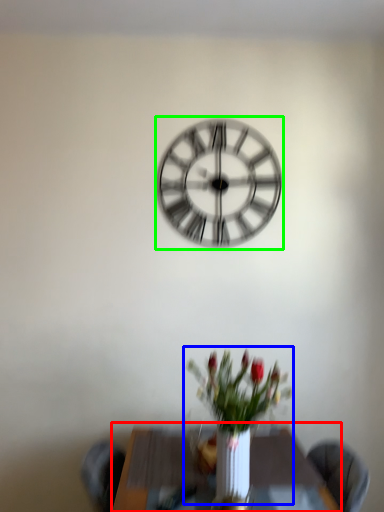
Question: Which object is positioned closest to table (highlighted by a red box)? Select from floral arrangement (highlighted by a blue box) and wall clock (highlighted by a green box).

Choices:
 (A) floral arrangement
 (B) wall clock

Answer: (A)